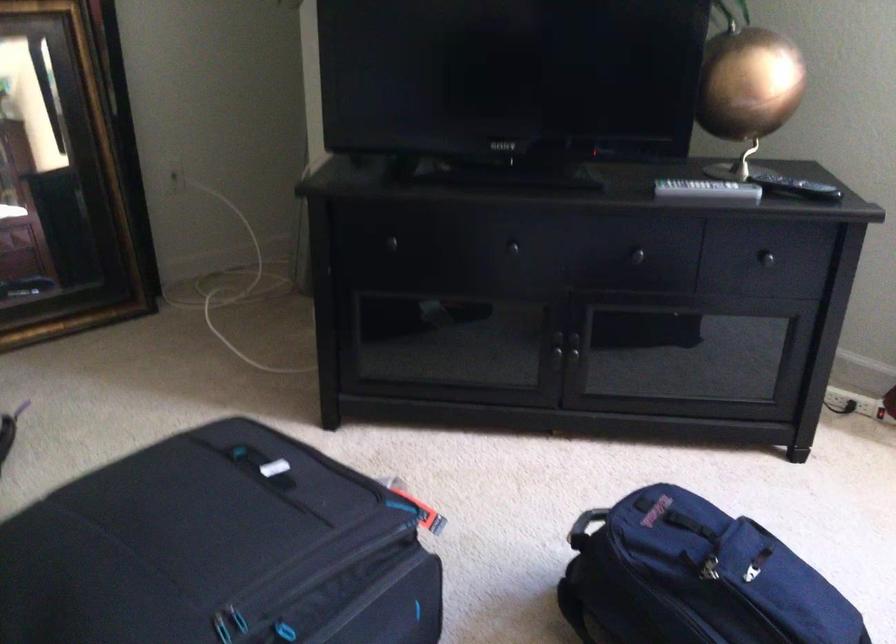
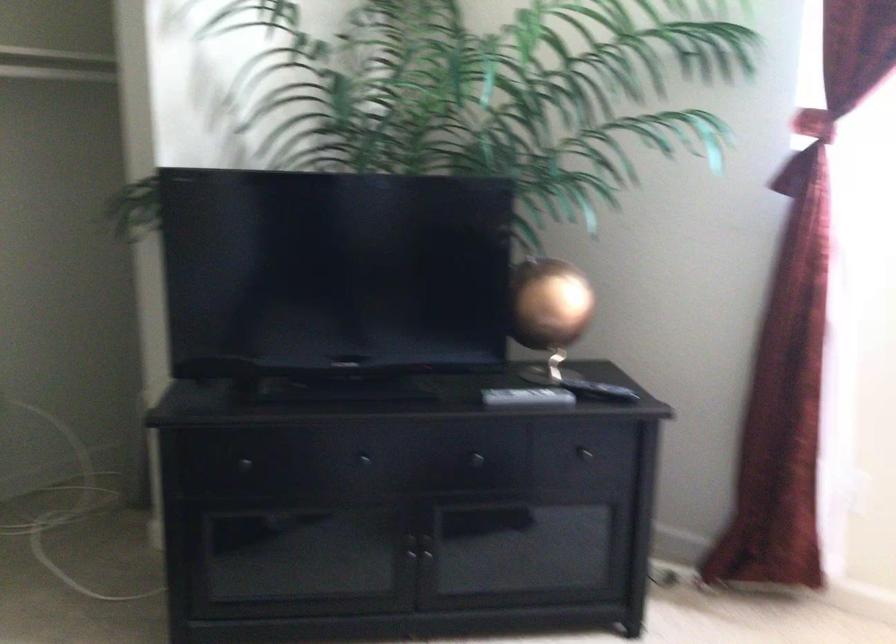
Locate, in the second image, the point that corresponds to point 738,91 in the first image.

(548, 310)